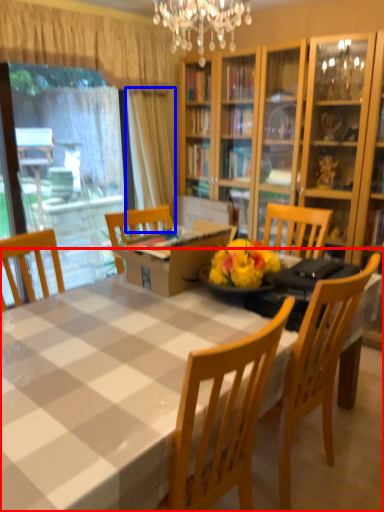
Question: Which point is further to the camera, kitchen & dining room table (highlighted by a red box) or curtain (highlighted by a blue box)?

Choices:
 (A) kitchen & dining room table
 (B) curtain

Answer: (B)